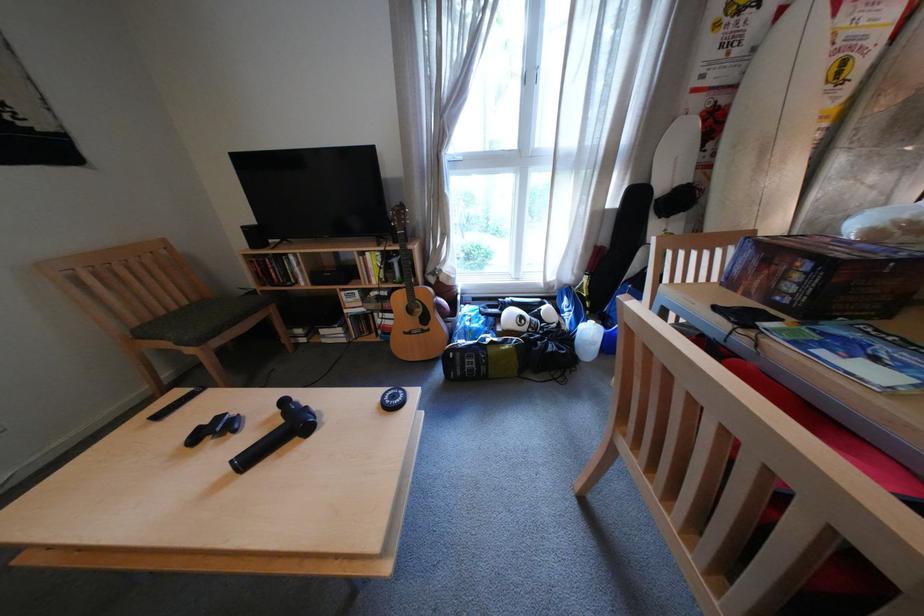
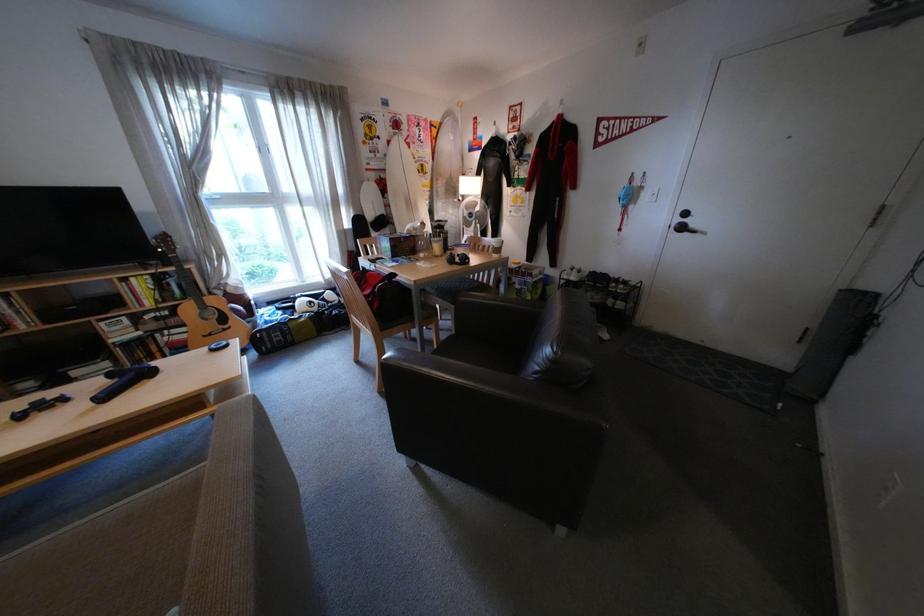
Locate, in the second image, the point that corresponds to [420,331] in the first image.

(220, 334)